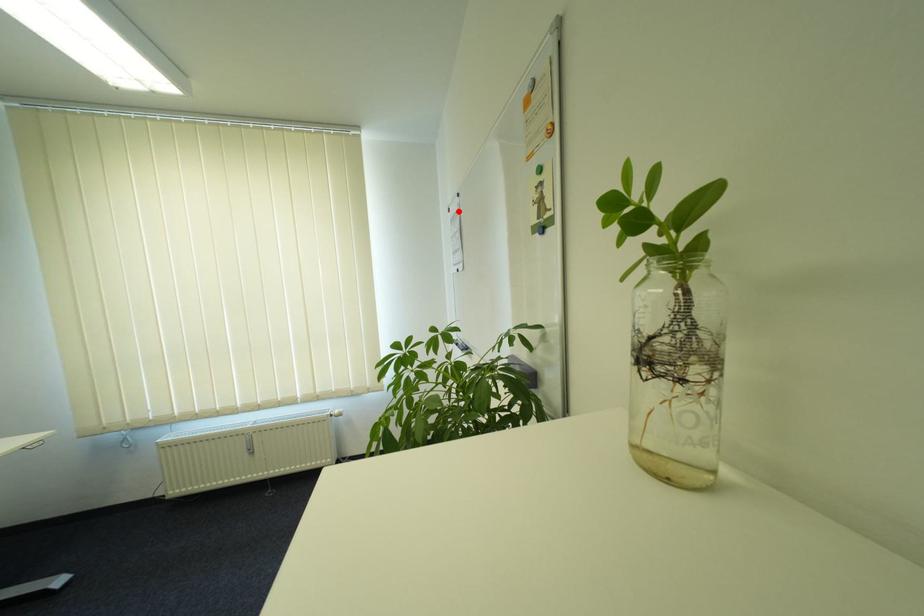
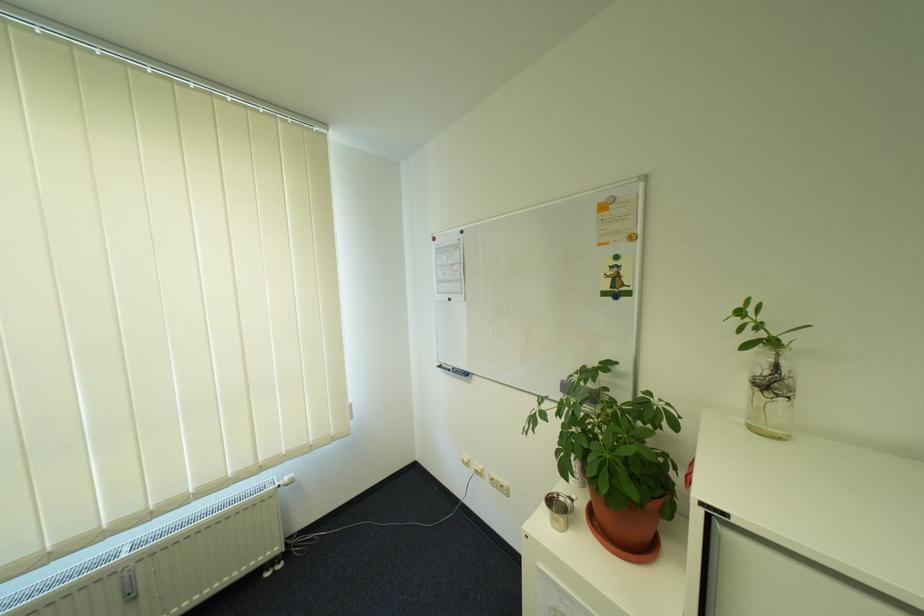
Find the pixel in the second image that matches the highlighted location in the first image.

(444, 240)